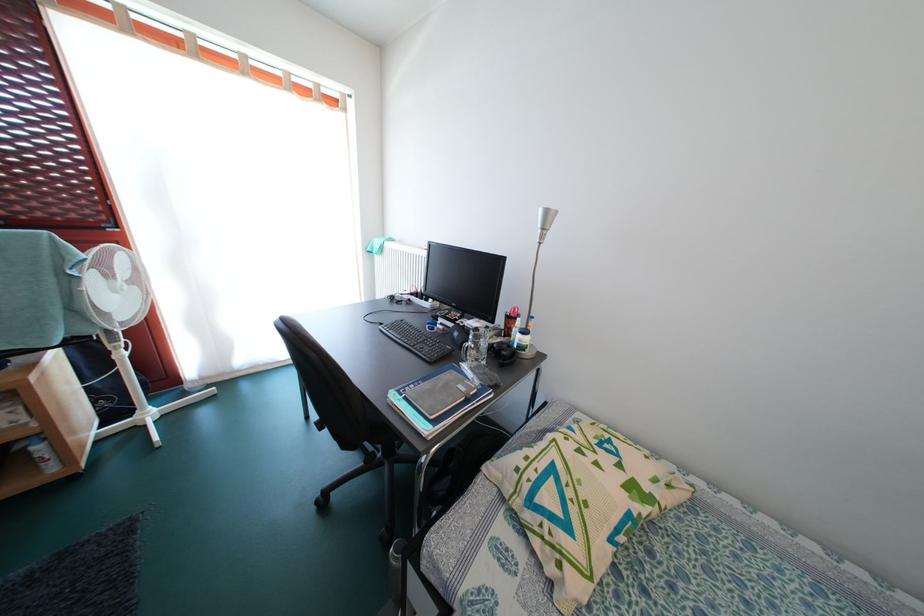
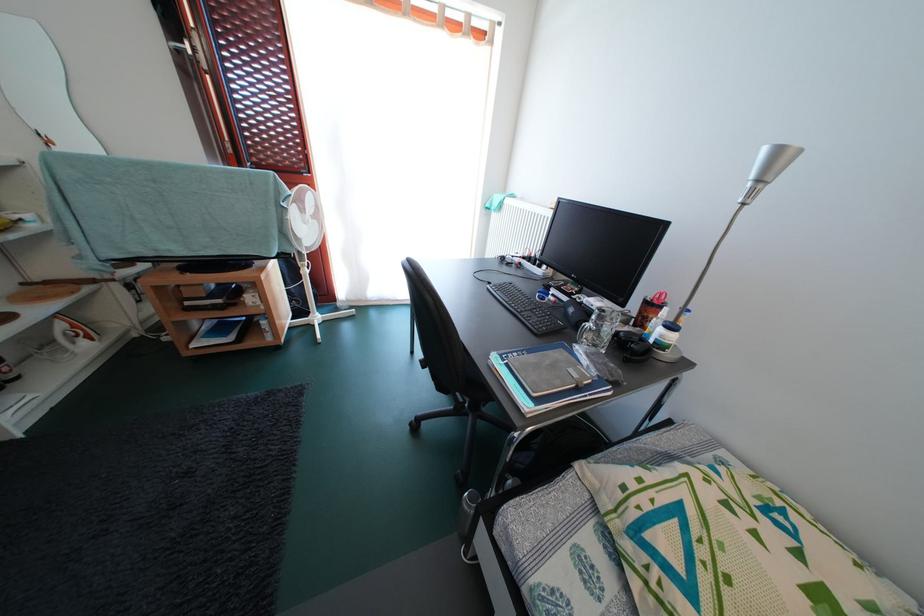
Where in the second image is the point corresponding to the point at 553,217 from the first image?

(785, 156)